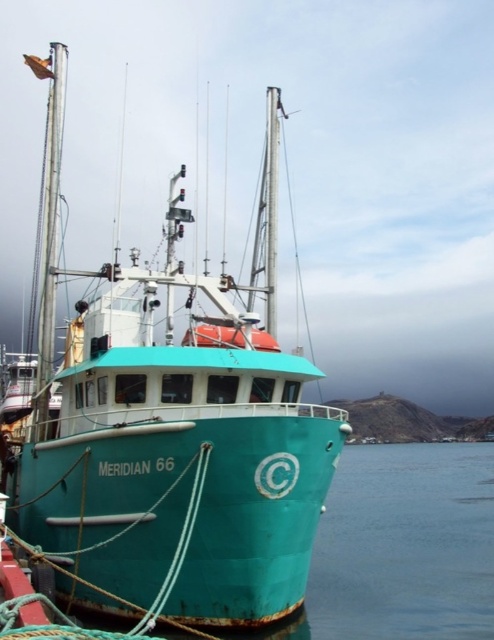
In the scene shown: Which of these two, teal matte boat at center or teal rubber boat at center, stands shorter?

With less height is teal rubber boat at center.

Where is `teal matte boat at center`? This screenshot has width=494, height=640. teal matte boat at center is located at coordinates (168, 432).